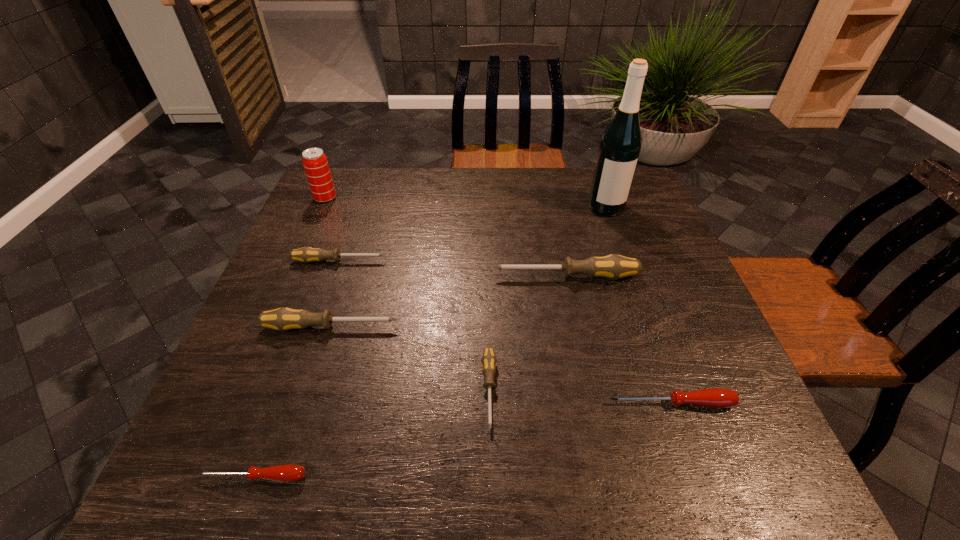
Identify which screwdriver is the third nearest to the farther red screwdriver. Please provide its 2D coordinates. Your answer should be formatted as a tuple, i.e. [(x, y)], where the tuple contains the x and y coordinates of a point satisfying the conditions above.

[(283, 319)]

Locate an element on the screen. gray screwdriver that is the second nearest to the wine bottle is located at coordinates (488, 361).

Select which gray screwdriver is the second closest to the smallest gray screwdriver. Please provide its 2D coordinates. Your answer should be formatted as a tuple, i.e. [(x, y)], where the tuple contains the x and y coordinates of a point satisfying the conditions above.

[(613, 266)]

Locate an element on the screen. blank space that satisfies the following two spatial constraints: 1. at the tip of the fifth shortest screwdriver; 2. on the back side of the bigger red screwdriver is located at coordinates (306, 403).

Find the location of a particular element. vacant point that satisfies the following two spatial constraints: 1. at the tip of the right red screwdriver; 2. on the right side of the tallest screwdriver is located at coordinates pyautogui.click(x=591, y=403).

Where is `vacant space that satisfies the following two spatial constraints: 1. at the tip of the farther red screwdriver; 2. on the left side of the farthest screwdriver`? The width and height of the screenshot is (960, 540). vacant space that satisfies the following two spatial constraints: 1. at the tip of the farther red screwdriver; 2. on the left side of the farthest screwdriver is located at coordinates (290, 403).

Locate an element on the screen. The height and width of the screenshot is (540, 960). vacant space that satisfies the following two spatial constraints: 1. on the label of the wine bottle; 2. at the tip of the biggest gray screwdriver is located at coordinates (631, 276).